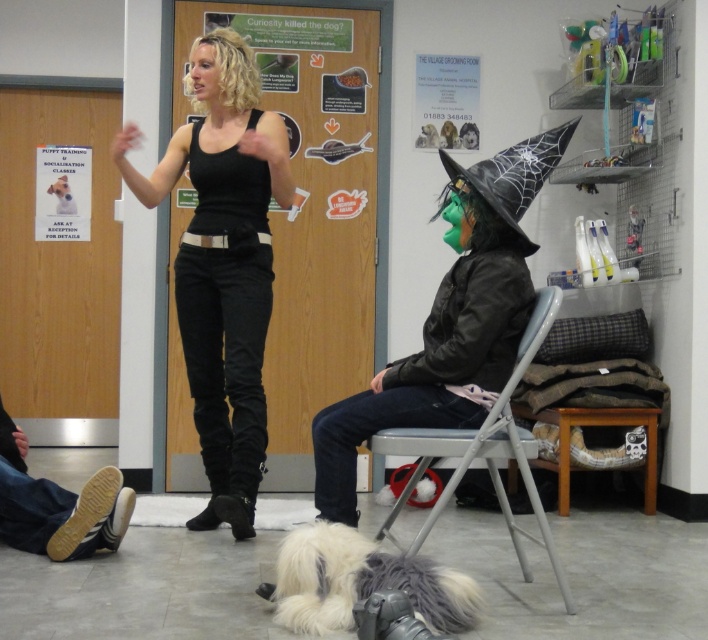
Question: Does green matte mask at center have a larger size compared to fluffy white fur at lower center?

Choices:
 (A) yes
 (B) no

Answer: (A)

Question: Is matte black tank top at center to the left of fluffy white fur at lower center from the viewer's perspective?

Choices:
 (A) no
 (B) yes

Answer: (B)

Question: Which point is closer to the camera?

Choices:
 (A) matte black tank top at center
 (B) brown wooden stool at lower center
 (C) white fluffy dog at center

Answer: (A)

Question: Which object is positioned farthest from the green matte mask at center?

Choices:
 (A) metallic gray chair at center
 (B) white fluffy dog at center

Answer: (B)

Question: Can you confirm if black leather witch hat at upper right is bigger than brown wooden stool at lower center?

Choices:
 (A) no
 (B) yes

Answer: (A)

Question: Considering the real-world distances, which object is farthest from the green matte mask at center?

Choices:
 (A) fluffy white fur at lower center
 (B) wooden door at center
 (C) white fluffy dog at center

Answer: (C)